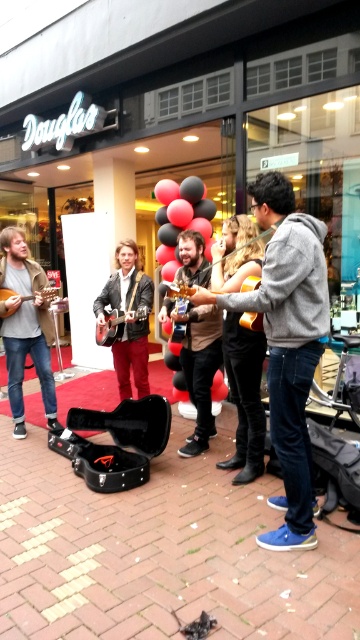
Measure the distance from glossy wood guitar at center to matte brown acoustic guitar at left.

7.06 feet

Is glossy wood guitar at center thinner than matte brown acoustic guitar at left?

Indeed, glossy wood guitar at center has a lesser width compared to matte brown acoustic guitar at left.

Between point (251, 314) and point (47, 288), which one is positioned behind?

The point (47, 288) is more distant.

The width and height of the screenshot is (360, 640). I want to click on glossy wood guitar at center, so click(x=251, y=321).

Which of these two, matte black guitar at center or glossy black guitar at center, stands shorter?

With less height is glossy black guitar at center.

Can you confirm if matte black guitar at center is wider than glossy black guitar at center?

Yes.

Which is in front, point (128, 244) or point (106, 316)?

Positioned in front is point (106, 316).

The image size is (360, 640). Find the location of `matte black guitar at center`. matte black guitar at center is located at coordinates (128, 317).

Between black matte balloons at center and glossy wood guitar at center, which one is positioned higher?

Positioned higher is black matte balloons at center.

Which is below, black matte balloons at center or glossy wood guitar at center?

Positioned lower is glossy wood guitar at center.

Find the location of `black matte balloons at center`. black matte balloons at center is located at coordinates (180, 218).